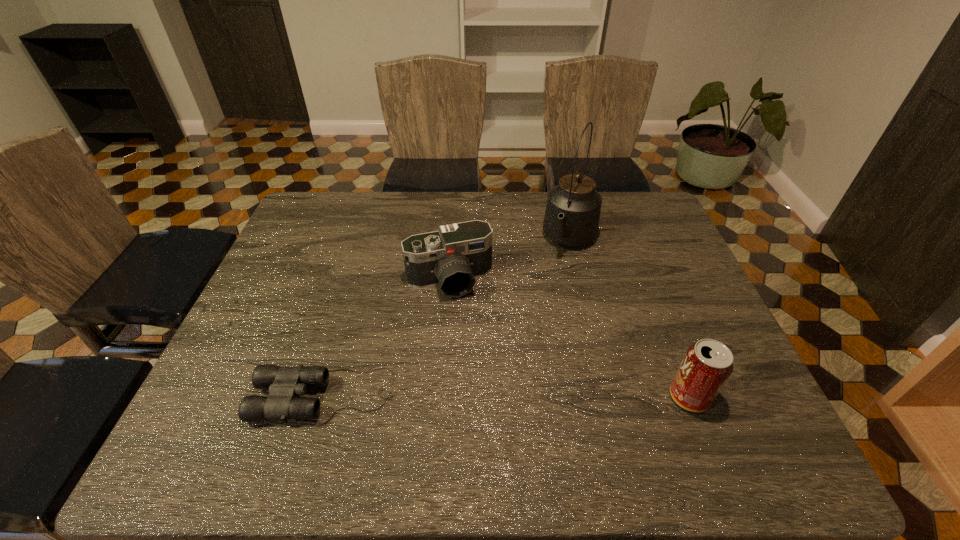
Where is `vacant space on the desktop that is between the shortest object and the soda can and is positioned on the front-facing side of the camera`? vacant space on the desktop that is between the shortest object and the soda can and is positioned on the front-facing side of the camera is located at coordinates (489, 396).

Identify the location of free space on the desktop that is between the shortest object and the rightmost object and is positioned spout on the third object from left to right. The height and width of the screenshot is (540, 960). pos(488,396).